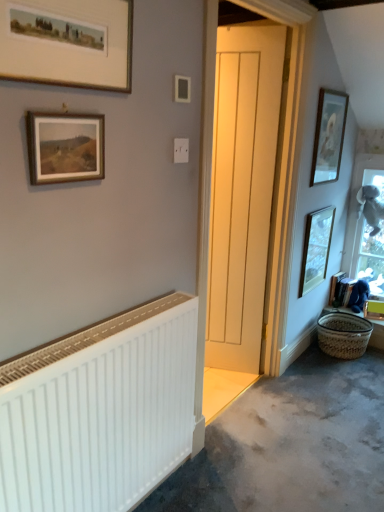
Image resolution: width=384 pixels, height=512 pixels. I want to click on clear glass window at right, so click(370, 232).

This screenshot has height=512, width=384. Describe the element at coordinates (370, 232) in the screenshot. I see `clear glass window at right` at that location.

What do you see at coordinates (100, 412) in the screenshot? This screenshot has height=512, width=384. I see `white matte radiator at lower left` at bounding box center [100, 412].

I want to click on wooden-framed painting at upper left, the 3th picture frame positioned from the back, so click(65, 147).

At what (x,y) coordinates should I click in order to perform the action: click on gold-framed print at upper left, marked as the first picture frame in a front-to-back arrangement. Please return your answer as a coordinate pair (x, y). Looking at the image, I should click on (68, 42).

Find the location of a particular element. The height and width of the screenshot is (512, 384). wooden picture frame at lower right, which appears as the second picture frame when viewed from the right is located at coordinates (316, 248).

Where is `gray carpet at lower right`? This screenshot has height=512, width=384. gray carpet at lower right is located at coordinates (291, 444).

Where is `woven straw basket at lower right`? The image size is (384, 512). woven straw basket at lower right is located at coordinates (343, 335).

At what (x,y) coordinates should I click in order to perform the action: click on clear glass window at right. Please return your answer as a coordinate pair (x, y). The width and height of the screenshot is (384, 512). Looking at the image, I should click on (370, 232).

Image resolution: width=384 pixels, height=512 pixels. Identify the location of concrete that is on the left side of woven straw basket at lower right. (291, 444).

Which is behind, point (332, 385) or point (344, 331)?

The point (344, 331) is farther from the camera.

How distant is gray carpet at lower right from woven straw basket at lower right?

30.30 inches.

In the scene shown: Which point is more distant from viewer, (372,267) or (347,313)?

The point (372,267) is behind.

Is clear glass window at right next to woven straw basket at lower right?

There is a gap between clear glass window at right and woven straw basket at lower right.

In terms of width, does clear glass window at right look wider or thinner when compared to woven straw basket at lower right?

Clearly, clear glass window at right has less width compared to woven straw basket at lower right.

Are wooden picture frame at lower right, the 3th picture frame positioned from the left, and matte wooden picture frame at upper right, acting as the first picture frame starting from the right, making contact?

No, wooden picture frame at lower right, the 3th picture frame positioned from the left, is not with matte wooden picture frame at upper right, acting as the first picture frame starting from the right.

In the scene shown: From a real-world perspective, does wooden picture frame at lower right, which appears as the second picture frame when viewed from the right, sit lower than matte wooden picture frame at upper right, which ranks as the 2th picture frame in back-to-front order?

Yes, from a real-world perspective, wooden picture frame at lower right, which appears as the second picture frame when viewed from the right, is under matte wooden picture frame at upper right, which ranks as the 2th picture frame in back-to-front order.

From the image's perspective, is wooden picture frame at lower right, the 3th picture frame positioned from the left, on matte wooden picture frame at upper right, the 4th picture frame in the left-to-right sequence?

Actually, wooden picture frame at lower right, the 3th picture frame positioned from the left, appears below matte wooden picture frame at upper right, the 4th picture frame in the left-to-right sequence, in the image.

From the image's perspective, is wooden picture frame at lower right, placed as the 4th picture frame when sorted from front to back, located beneath wooden-framed painting at upper left, the 3th picture frame positioned from the back?

Yes, from the image's perspective, wooden picture frame at lower right, placed as the 4th picture frame when sorted from front to back, is below wooden-framed painting at upper left, the 3th picture frame positioned from the back.

Considering the sizes of objects wooden picture frame at lower right, the 3th picture frame positioned from the left, and wooden-framed painting at upper left, which appears as the 1th picture frame when viewed from the left, in the image provided, who is bigger, wooden picture frame at lower right, the 3th picture frame positioned from the left, or wooden-framed painting at upper left, which appears as the 1th picture frame when viewed from the left,?

wooden picture frame at lower right, the 3th picture frame positioned from the left.

Between wooden picture frame at lower right, the 3th picture frame positioned from the left, and wooden-framed painting at upper left, which appears as the 1th picture frame when viewed from the left, which one has larger width?

wooden picture frame at lower right, the 3th picture frame positioned from the left.

You are a GUI agent. You are given a task and a screenshot of the screen. Output one action in this format:
    pyautogui.click(x=<x>, y=<y>)
    Task: Click on the picture frame below the wooden-framed painting at upper left, which is the fourth picture frame in right-to-left order (from the image's perspective)
    The image size is (384, 512).
    Given the screenshot: What is the action you would take?
    316,248

Is white wooden door at center taller than wooden-framed painting at upper left, which is counted as the 2th picture frame, starting from the front?

Yes, white wooden door at center is taller than wooden-framed painting at upper left, which is counted as the 2th picture frame, starting from the front.

Is white wooden door at center placed right next to wooden-framed painting at upper left, which is counted as the 2th picture frame, starting from the front?

They are not placed beside each other.

From the picture: How different are the orientations of white wooden door at center and wooden-framed painting at upper left, which is the fourth picture frame in right-to-left order, in degrees?

64.7 degrees.

Considering the sizes of white wooden door at center and wooden-framed painting at upper left, which is counted as the 2th picture frame, starting from the front, in the image, is white wooden door at center wider or thinner than wooden-framed painting at upper left, which is counted as the 2th picture frame, starting from the front,?

Considering their sizes, white wooden door at center looks broader than wooden-framed painting at upper left, which is counted as the 2th picture frame, starting from the front.

Considering their positions, is wooden-framed painting at upper left, which appears as the 1th picture frame when viewed from the left, located in front of or behind matte wooden picture frame at upper right, which ranks as the 2th picture frame in back-to-front order?

wooden-framed painting at upper left, which appears as the 1th picture frame when viewed from the left, is positioned closer to the viewer than matte wooden picture frame at upper right, which ranks as the 2th picture frame in back-to-front order.

How many degrees apart are the facing directions of wooden-framed painting at upper left, which is the fourth picture frame in right-to-left order, and matte wooden picture frame at upper right, acting as the first picture frame starting from the right?

The facing directions of wooden-framed painting at upper left, which is the fourth picture frame in right-to-left order, and matte wooden picture frame at upper right, acting as the first picture frame starting from the right, are 0.00266 degrees apart.

From the image's perspective, is wooden-framed painting at upper left, which is the fourth picture frame in right-to-left order, above or below matte wooden picture frame at upper right, the 3th picture frame in the front-to-back sequence?

wooden-framed painting at upper left, which is the fourth picture frame in right-to-left order, is below matte wooden picture frame at upper right, the 3th picture frame in the front-to-back sequence.

What's the angular difference between gray carpet at lower right and wooden-framed painting at upper left, which appears as the 1th picture frame when viewed from the left,'s facing directions?

They differ by 90 degrees in their facing directions.

Consider the image. From the image's perspective, does gray carpet at lower right appear higher than wooden-framed painting at upper left, which is the fourth picture frame in right-to-left order?

Incorrect, from the image's perspective, gray carpet at lower right is lower than wooden-framed painting at upper left, which is the fourth picture frame in right-to-left order.

Which object is more forward, gray carpet at lower right or wooden-framed painting at upper left, which is counted as the 2th picture frame, starting from the front?

wooden-framed painting at upper left, which is counted as the 2th picture frame, starting from the front.

Is gray carpet at lower right wider or thinner than wooden-framed painting at upper left, the 3th picture frame positioned from the back?

Considering their sizes, gray carpet at lower right looks broader than wooden-framed painting at upper left, the 3th picture frame positioned from the back.

Where is `basket that appears behind the gray carpet at lower right`? The width and height of the screenshot is (384, 512). basket that appears behind the gray carpet at lower right is located at coordinates (343, 335).

Locate an element on the screen. The image size is (384, 512). basket on the left of clear glass window at right is located at coordinates (343, 335).

Looking at this image, estimate the real-world distances between objects in this image. Which object is closer to white wooden door at center, clear glass window at right or wooden-framed painting at upper left, which is the fourth picture frame in right-to-left order?

Among the two, clear glass window at right is located nearer to white wooden door at center.

Consider the image. Based on their spatial positions, is clear glass window at right or woven straw basket at lower right further from wooden-framed painting at upper left, which appears as the 1th picture frame when viewed from the left?

clear glass window at right.

Looking at the image, which one is located closer to white wooden door at center, gray carpet at lower right or wooden picture frame at lower right, positioned as the first picture frame in back-to-front order?

The object closer to white wooden door at center is wooden picture frame at lower right, positioned as the first picture frame in back-to-front order.

From the image, which object appears to be nearer to white wooden door at center, wooden picture frame at lower right, the 3th picture frame positioned from the left, or white matte radiator at lower left?

wooden picture frame at lower right, the 3th picture frame positioned from the left, is positioned closer to the anchor white wooden door at center.

From the image, which object appears to be farther from wooden picture frame at lower right, positioned as the first picture frame in back-to-front order, white matte radiator at lower left or wooden-framed painting at upper left, which is the fourth picture frame in right-to-left order?

Based on the image, wooden-framed painting at upper left, which is the fourth picture frame in right-to-left order, appears to be further to wooden picture frame at lower right, positioned as the first picture frame in back-to-front order.

Considering their positions, is wooden-framed painting at upper left, the 3th picture frame positioned from the back, positioned further to wooden picture frame at lower right, placed as the 4th picture frame when sorted from front to back, than woven straw basket at lower right?

wooden-framed painting at upper left, the 3th picture frame positioned from the back.

Estimate the real-world distances between objects in this image. Which object is further from gray carpet at lower right, wooden-framed painting at upper left, which is counted as the 2th picture frame, starting from the front, or wooden picture frame at lower right, the 3th picture frame positioned from the left?

wooden-framed painting at upper left, which is counted as the 2th picture frame, starting from the front, lies further to gray carpet at lower right than the other object.

Looking at the image, which one is located closer to clear glass window at right, woven straw basket at lower right or wooden-framed painting at upper left, which appears as the 1th picture frame when viewed from the left?

Among the two, woven straw basket at lower right is located nearer to clear glass window at right.

The image size is (384, 512). Identify the location of door between gold-framed print at upper left, which appears as the fourth picture frame when viewed from the back, and wooden picture frame at lower right, positioned as the first picture frame in back-to-front order, from front to back. (242, 190).

Image resolution: width=384 pixels, height=512 pixels. In order to click on door located between white matte radiator at lower left and clear glass window at right in the depth direction in this screenshot , I will do `click(242, 190)`.

The image size is (384, 512). I want to click on door positioned between white matte radiator at lower left and wooden picture frame at lower right, placed as the 4th picture frame when sorted from front to back, from near to far, so click(x=242, y=190).

The width and height of the screenshot is (384, 512). I want to click on door between wooden-framed painting at upper left, which appears as the 1th picture frame when viewed from the left, and woven straw basket at lower right from front to back, so click(x=242, y=190).